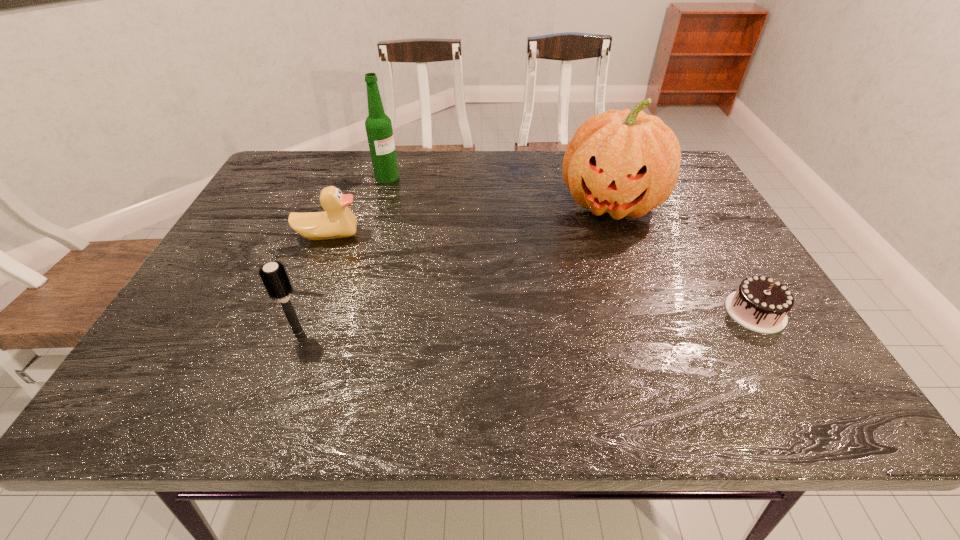
Where is `free location located on the carved face of the second object from right to left`? The image size is (960, 540). free location located on the carved face of the second object from right to left is located at coordinates (579, 307).

Where is `free space located at the beak of the second shortest object`? The height and width of the screenshot is (540, 960). free space located at the beak of the second shortest object is located at coordinates (422, 282).

Where is `blank space located at the beak of the second shortest object`? This screenshot has width=960, height=540. blank space located at the beak of the second shortest object is located at coordinates (403, 271).

This screenshot has width=960, height=540. I want to click on vacant space located 0.350m at the beak of the second shortest object, so click(460, 303).

Where is `free spot located 0.360m on the label of the beer bottle`? This screenshot has height=540, width=960. free spot located 0.360m on the label of the beer bottle is located at coordinates (473, 239).

The width and height of the screenshot is (960, 540). I want to click on free space located 0.320m on the label of the beer bottle, so click(x=463, y=232).

Locate an element on the screen. This screenshot has width=960, height=540. vacant area located on the label of the beer bottle is located at coordinates (433, 210).

The width and height of the screenshot is (960, 540). In order to click on pumpkin that is at the far edge in this screenshot , I will do `click(626, 163)`.

Find the location of a particular element. The height and width of the screenshot is (540, 960). beer bottle at the far edge is located at coordinates (378, 125).

I want to click on hairbrush that is at the near edge, so click(273, 275).